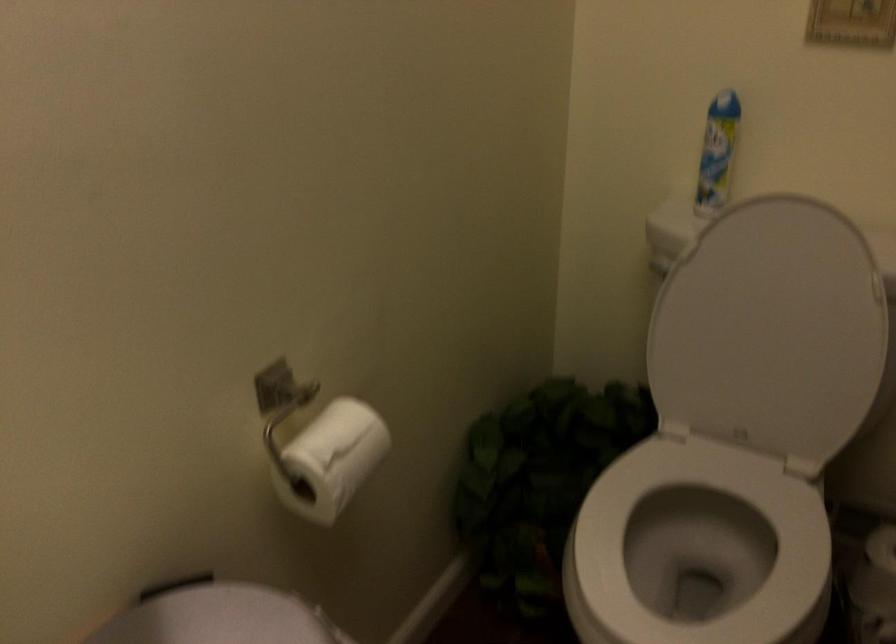
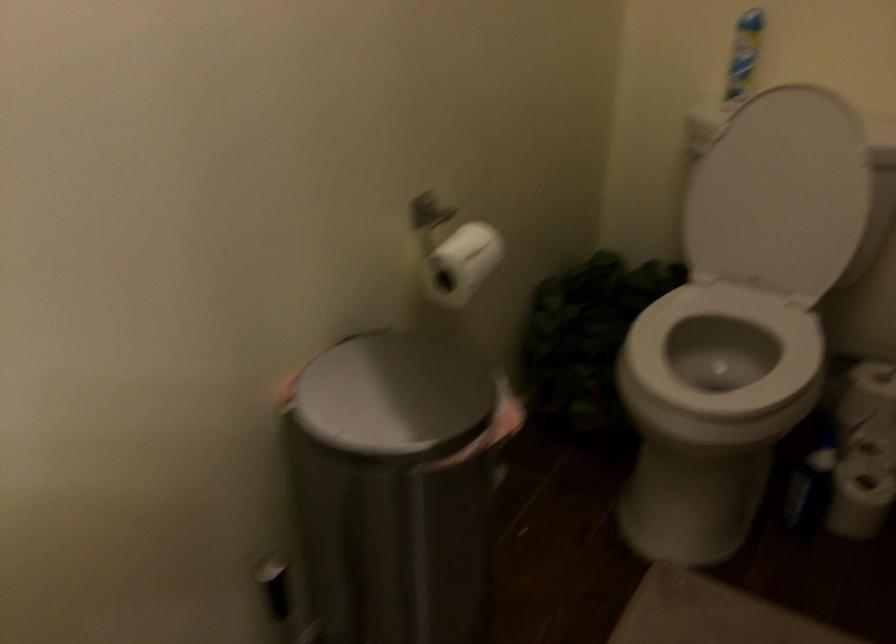
What movement of the cameraman would produce the second image?

Result: The cameraman moved toward left, backward.